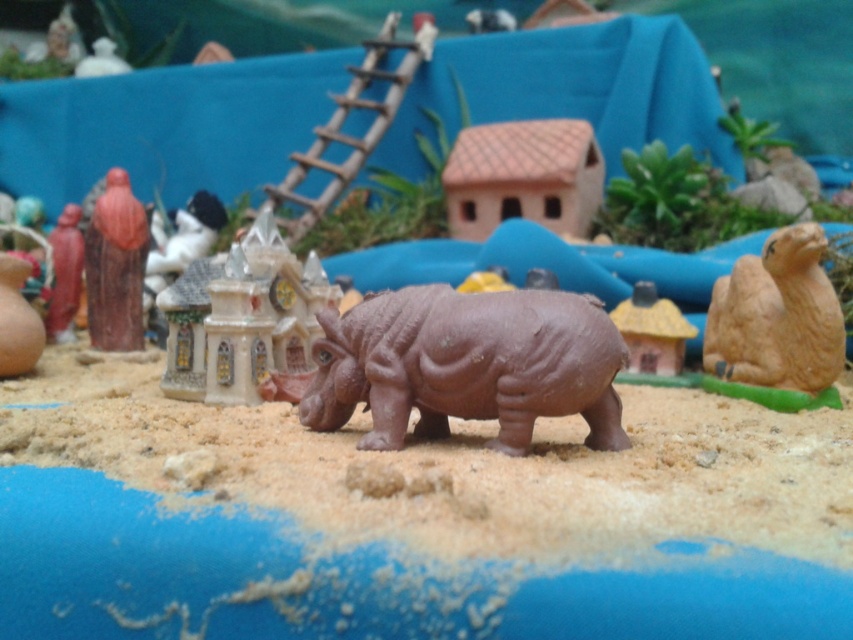
You are setting up a miniature diorama and want to place a new figure between the brown matte camel at right and the wooden statue at left. Based on their positions, which side should you place the new figure closer to?

The brown matte camel at right is to the right of the wooden statue at left, so placing the new figure closer to the wooden statue at left would position it between them.

You are setting up a display and need to place a 12 cm tall figurine. You have the matte plastic castle at center and the wooden statue at left. Which object can accommodate the figurine without it looking too small in comparison?

The matte plastic castle at center is larger than the wooden statue at left, so placing the 12 cm tall figurine on the castle would ensure it doesn not look too small in comparison.

Where is the brown matte sand at center located in the coordinate system?

The brown matte sand at center is located at point coordinates of (459, 467).